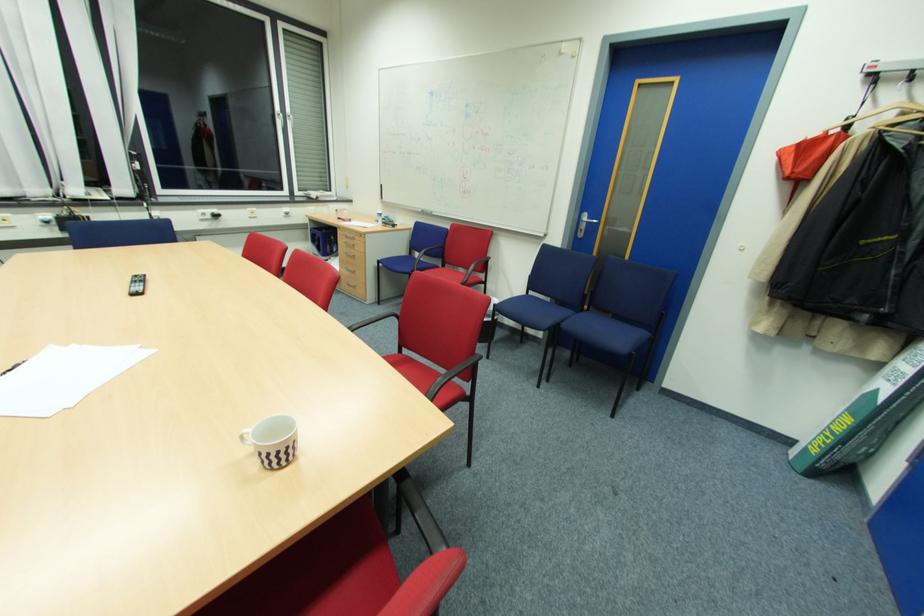
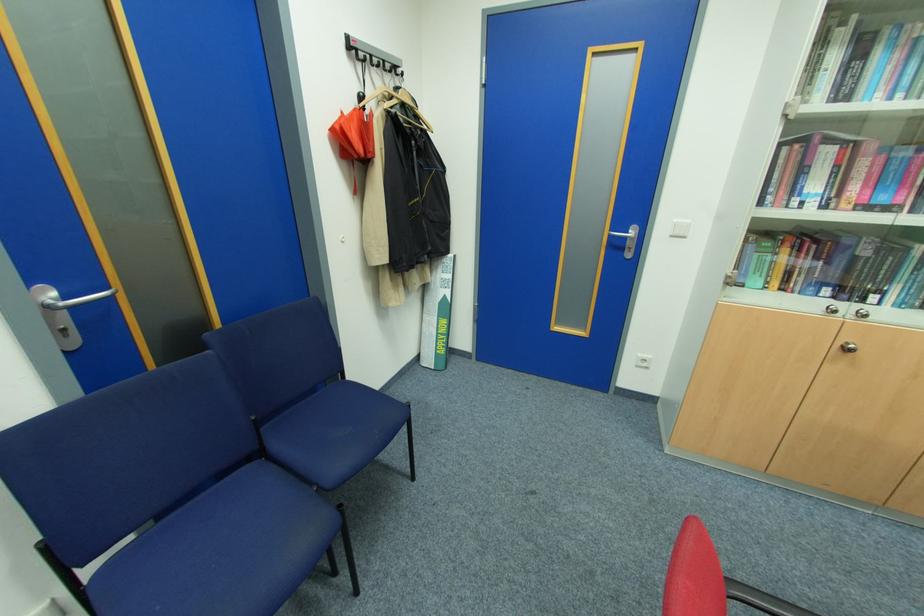
Find the pixel in the second image that matches (x=870, y=83) in the first image.

(353, 55)